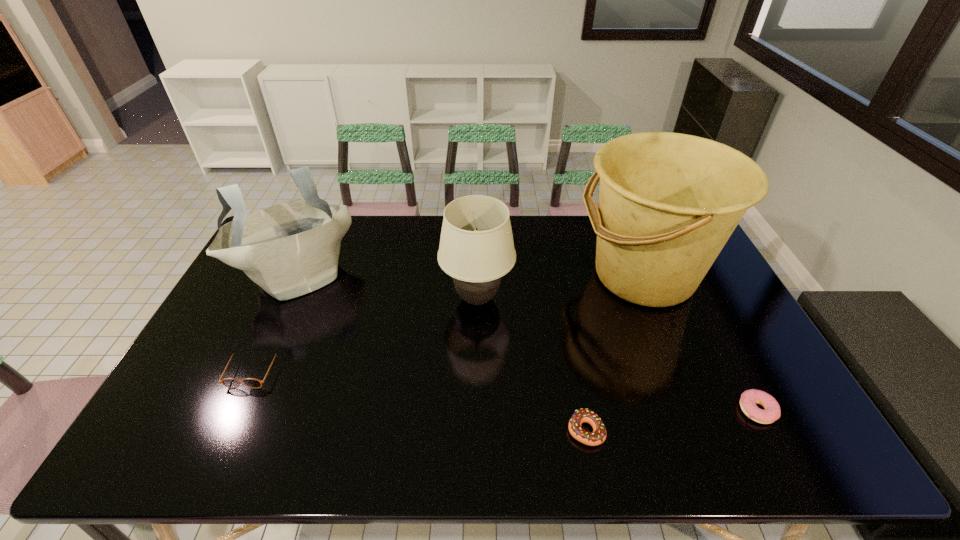
At what (x,y) coordinates should I click in order to perform the action: click on doughnut situated at the right edge. Please return your answer as a coordinate pair (x, y). This screenshot has width=960, height=540. Looking at the image, I should click on (772, 412).

At what (x,y) coordinates should I click in order to perform the action: click on object that is at the far left corner. Please return your answer as a coordinate pair (x, y). The image size is (960, 540). Looking at the image, I should click on (290, 249).

Where is `object situated at the far right corner`? The image size is (960, 540). object situated at the far right corner is located at coordinates (668, 202).

The image size is (960, 540). Identify the location of vacant region at the far edge of the desktop. (386, 245).

Locate an element on the screen. Image resolution: width=960 pixels, height=540 pixels. vacant point at the near edge is located at coordinates (472, 446).

Where is `vacant area at the left edge of the desktop`? The width and height of the screenshot is (960, 540). vacant area at the left edge of the desktop is located at coordinates (179, 390).

Where is `blank area at the right edge`? The image size is (960, 540). blank area at the right edge is located at coordinates (687, 306).

This screenshot has width=960, height=540. In the image, there is a desktop. What are the coordinates of `vacant space at the near left corner` in the screenshot? It's located at (154, 450).

Where is `free space between the lampshade and the bucket`? This screenshot has height=540, width=960. free space between the lampshade and the bucket is located at coordinates (561, 287).

The height and width of the screenshot is (540, 960). Identify the location of unoccupied position between the third object from left to right and the left doughnut. (532, 364).